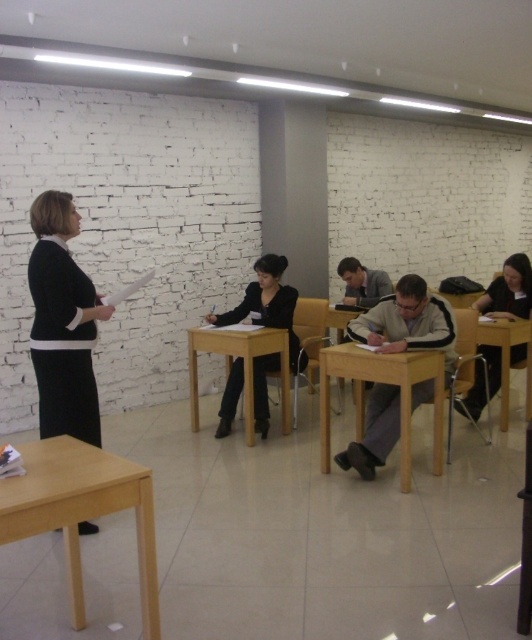
You are a student who needs to place a tall textbook on the table. Which table, the light brown wooden table at lower left or the wooden table at right, would be more suitable for placing the tall textbook?

The wooden table at right is taller than the light brown wooden table at lower left, so the wooden table at right would be more suitable for placing the tall textbook.

You are a student sitting at the light brown wooden table at lower left. You need to reach the black matte skirt at left to borrow a pen. Can you easily reach it while sitting at your table?

The light brown wooden table at lower left is positioned under the black matte skirt at left, so the black matte skirt at left is likely above the table. Since you are sitting at the table, you can easily reach up to borrow the pen from the black matte skirt at left.